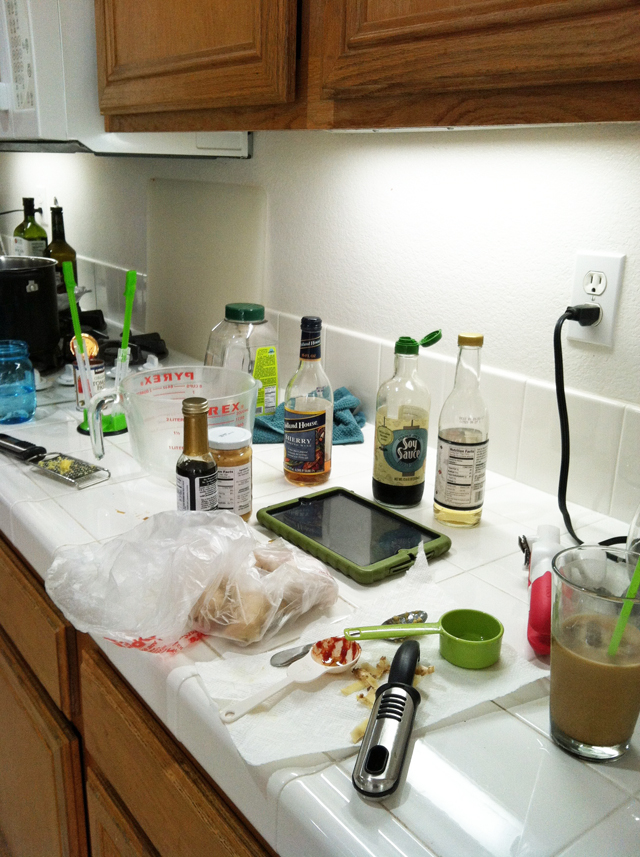
Find the location of a particular element. black tablet divice is located at coordinates (360, 535).